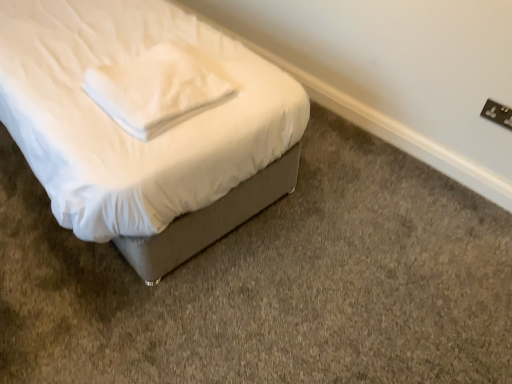
What do you see at coordinates (158, 89) in the screenshot? This screenshot has width=512, height=384. I see `white soft pillow at upper center` at bounding box center [158, 89].

Image resolution: width=512 pixels, height=384 pixels. I want to click on white soft pillow at upper center, so click(158, 89).

You are a GUI agent. You are given a task and a screenshot of the screen. Output one action in this format:
    pyautogui.click(x=<x>, y=<y>)
    Task: Click on the white soft pillow at upper center
    This screenshot has height=384, width=512.
    Given the screenshot: What is the action you would take?
    pyautogui.click(x=158, y=89)